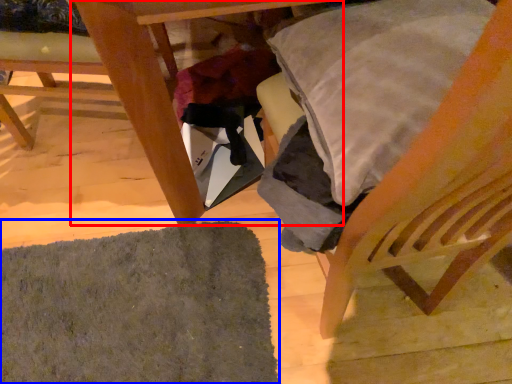
Question: Which object appears farthest to the camera in this image, table (highlighted by a red box) or mat (highlighted by a blue box)?

Choices:
 (A) table
 (B) mat

Answer: (B)